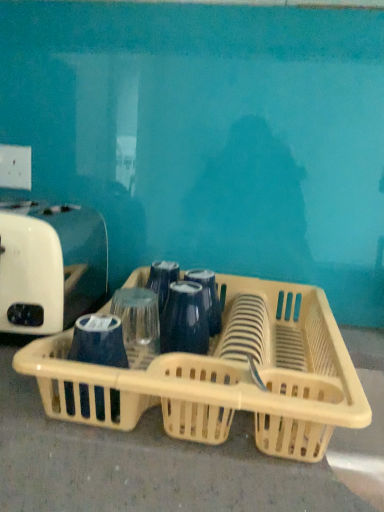
Question: Visually, is beige plastic basket at center positioned to the left or to the right of white plastic toaster at left?

Choices:
 (A) right
 (B) left

Answer: (A)

Question: Is beige plastic basket at center wider or thinner than white plastic toaster at left?

Choices:
 (A) thin
 (B) wide

Answer: (B)

Question: Is beige plastic basket at center taller or shorter than white plastic toaster at left?

Choices:
 (A) tall
 (B) short

Answer: (B)

Question: Is white plastic toaster at left spatially inside beige plastic basket at center, or outside of it?

Choices:
 (A) outside
 (B) inside

Answer: (A)

Question: Relative to beige plastic basket at center, is white plastic toaster at left in front or behind?

Choices:
 (A) behind
 (B) front

Answer: (A)

Question: Based on their sizes in the image, would you say white plastic toaster at left is bigger or smaller than beige plastic basket at center?

Choices:
 (A) big
 (B) small

Answer: (B)

Question: Considering the positions of point (41, 261) and point (251, 328), is point (41, 261) closer or farther from the camera than point (251, 328)?

Choices:
 (A) closer
 (B) farther

Answer: (A)